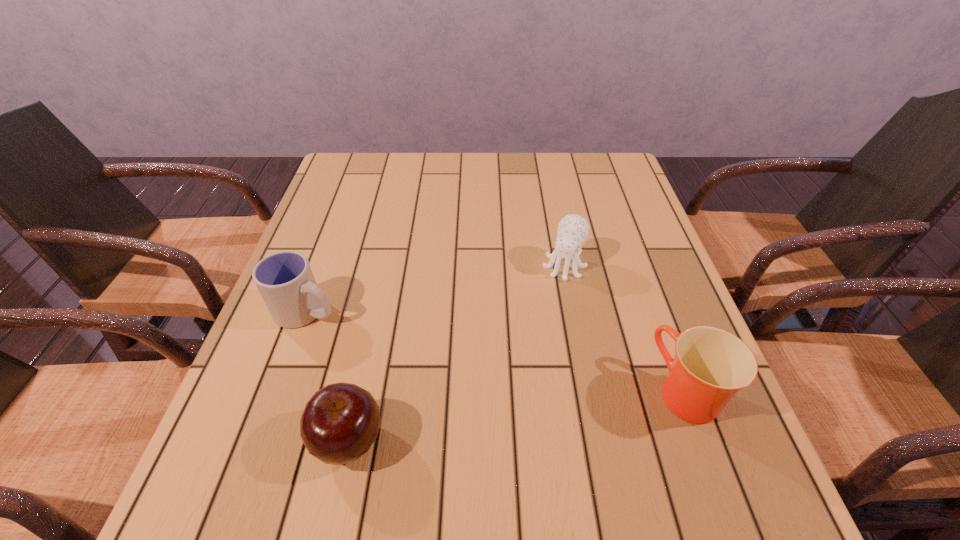
Where is `free space located 0.130m with the handle on the side of the third nearest object`? The width and height of the screenshot is (960, 540). free space located 0.130m with the handle on the side of the third nearest object is located at coordinates (381, 343).

Locate an element on the screen. The width and height of the screenshot is (960, 540). free spot located with the handle on the side of the third nearest object is located at coordinates (417, 361).

Identify the location of free location located 0.230m on the front-facing side of the farthest object. The width and height of the screenshot is (960, 540). (523, 355).

Where is `free space located on the front-facing side of the farthest object`? The height and width of the screenshot is (540, 960). free space located on the front-facing side of the farthest object is located at coordinates (516, 370).

Identify the location of free location located on the front-facing side of the farthest object. (551, 296).

Where is `apple located in the near edge section of the desktop`? The image size is (960, 540). apple located in the near edge section of the desktop is located at coordinates (340, 422).

The image size is (960, 540). In order to click on cup located in the near edge section of the desktop in this screenshot , I will do pyautogui.click(x=711, y=365).

The width and height of the screenshot is (960, 540). What are the coordinates of `object located in the left edge section of the desktop` in the screenshot? It's located at (285, 280).

The width and height of the screenshot is (960, 540). Find the location of `object located at the right edge`. object located at the right edge is located at coordinates (711, 365).

Identify the location of object at the near right corner. This screenshot has height=540, width=960. (711, 365).